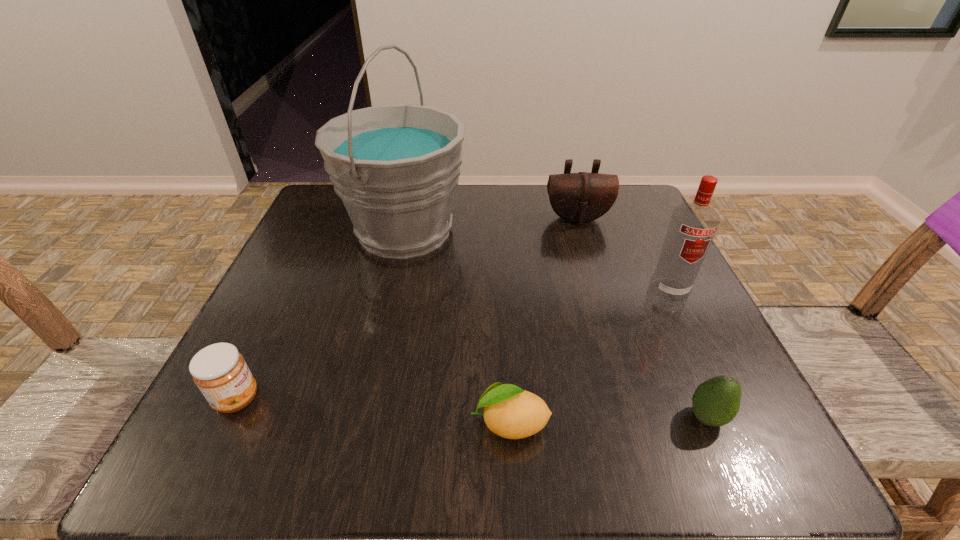
Locate an element on the screen. Image resolution: width=960 pixels, height=540 pixels. vacant region located on the front label of the vodka is located at coordinates (687, 329).

Locate an element on the screen. The image size is (960, 540). free space located with the flap open on the pouch is located at coordinates (588, 256).

At what (x,y) coordinates should I click in order to perform the action: click on free space located on the front label of the leftmost object. Please return your answer as a coordinate pair (x, y). Looking at the image, I should click on (423, 399).

Identify the location of vacant space located on the left of the avocado. (503, 417).

You are a GUI agent. You are given a task and a screenshot of the screen. Output one action in this format:
    pyautogui.click(x=<x>, y=<y>)
    Task: Click on the free location located with leaves positioned above the shortest object
    This screenshot has width=960, height=540.
    Given the screenshot: What is the action you would take?
    pyautogui.click(x=198, y=423)

Where is `vacant space located 0.210m with leaves positioned above the shortest object`? The height and width of the screenshot is (540, 960). vacant space located 0.210m with leaves positioned above the shortest object is located at coordinates click(x=320, y=423).

Find the location of `vacant region located 0.080m with leaves positioned above the shortest object`. vacant region located 0.080m with leaves positioned above the shortest object is located at coordinates (414, 423).

What are the coordinates of `bucket located at the far edge` in the screenshot? It's located at (395, 167).

Where is `pouch that is at the far edge`? The height and width of the screenshot is (540, 960). pouch that is at the far edge is located at coordinates (582, 197).

Where is `jam present at the near edge`? Image resolution: width=960 pixels, height=540 pixels. jam present at the near edge is located at coordinates (220, 372).